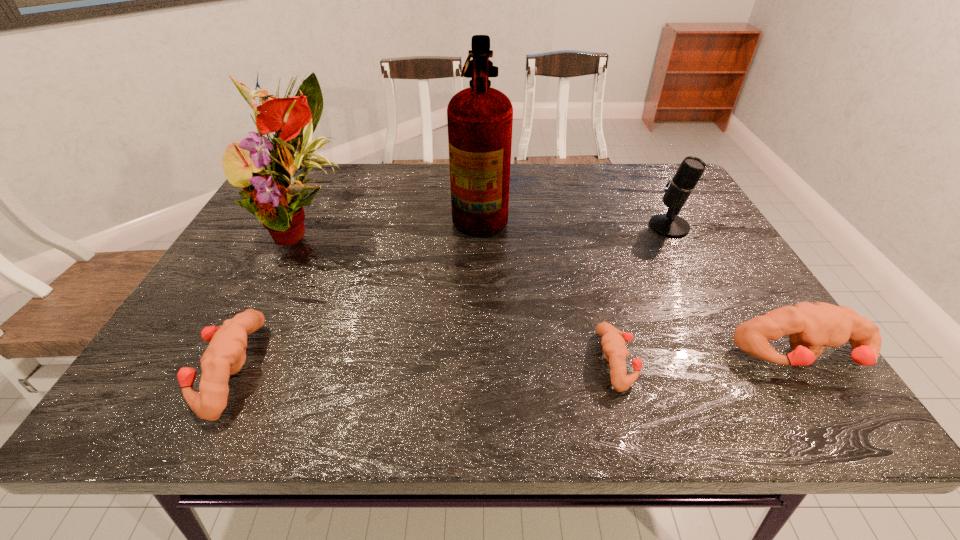
Locate an element on the screen. The width and height of the screenshot is (960, 540). vacant space situated with the gloves of the shortest object facing forward is located at coordinates 695,361.

You are a GUI agent. You are given a task and a screenshot of the screen. Output one action in this format:
    pyautogui.click(x=<x>, y=<y>)
    Task: Click on the free region located 0.350m at the nozzle of the fire extinguisher
    This screenshot has width=960, height=540.
    Given the screenshot: What is the action you would take?
    pyautogui.click(x=332, y=210)

The height and width of the screenshot is (540, 960). Find the location of `blank area located 0.140m at the nozzle of the fire extinguisher`. blank area located 0.140m at the nozzle of the fire extinguisher is located at coordinates (405, 210).

Identify the location of vacant region located at the nozzle of the fire extinguisher. The image size is (960, 540). (x=415, y=210).

Identify the location of vacant area situated 0.170m on the front-facing side of the bouquet. The height and width of the screenshot is (540, 960). (261, 318).

The image size is (960, 540). What are the coordinates of `vacant space located 0.330m on the left of the microphone` in the screenshot? It's located at (530, 226).

Locate an element on the screen. The image size is (960, 540). fire extinguisher that is at the far edge is located at coordinates (480, 118).

Find the location of `bouquet positioned at the far edge`. bouquet positioned at the far edge is located at coordinates (277, 199).

Locate an element on the screen. puncher positioned at the left edge is located at coordinates (226, 354).

Find the location of `bouquet at the left edge`. bouquet at the left edge is located at coordinates (277, 199).